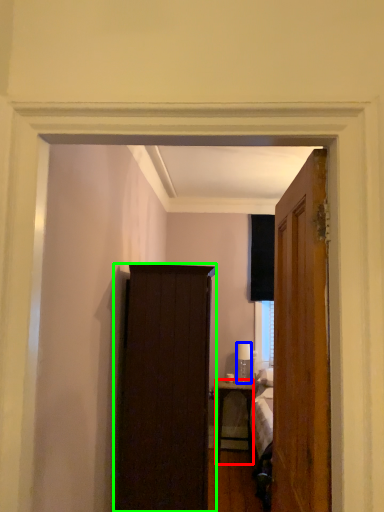
Question: Which is farther away from desk (highlighted by a red box)? lamp (highlighted by a blue box) or cabinetry (highlighted by a green box)?

Choices:
 (A) lamp
 (B) cabinetry

Answer: (B)